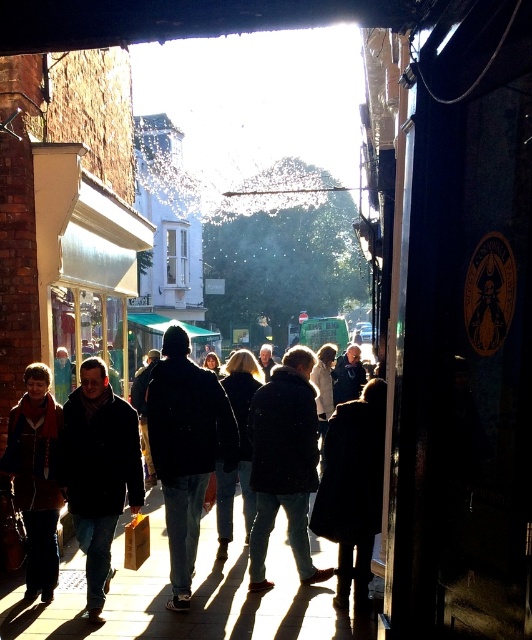
Is dark matte clothing at center to the right of smooth concrete pavement at center from the viewer's perspective?

No, dark matte clothing at center is not to the right of smooth concrete pavement at center.

Is dark matte clothing at center thinner than smooth concrete pavement at center?

Yes.

Between point (187, 563) and point (294, 596), which one is positioned in front?

Point (187, 563) is more forward.

This screenshot has height=640, width=532. What are the coordinates of `dark matte clothing at center` in the screenshot? It's located at (187, 582).

How far apart are smooth concrete pavement at center and brown leather jacket at lower left?

3.36 feet

Which is in front, point (139, 579) or point (37, 528)?

Point (37, 528) is more forward.

Identify the location of smooth concrete pavement at center. This screenshot has width=532, height=640. (193, 595).

Can you confirm if dark matte clothing at center is shorter than brown leather jacket at lower left?

Incorrect, dark matte clothing at center's height does not fall short of brown leather jacket at lower left's.

Can you confirm if dark matte clothing at center is taller than brown leather jacket at lower left?

Yes.

Which is behind, point (119, 552) or point (59, 506)?

The point (119, 552) is more distant.

Locate an element on the screen. The height and width of the screenshot is (640, 532). dark matte clothing at center is located at coordinates (187, 582).